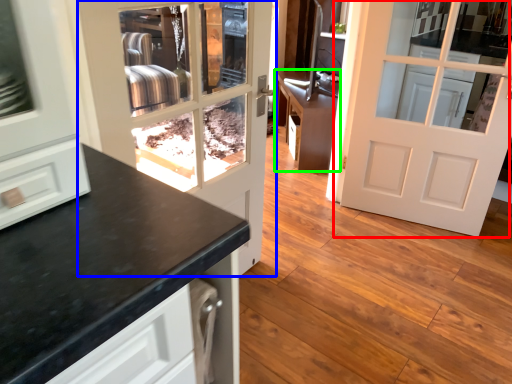
Question: Which is farther away from door (highlighted by a red box)? door (highlighted by a blue box) or cabinetry (highlighted by a green box)?

Choices:
 (A) door
 (B) cabinetry

Answer: (A)